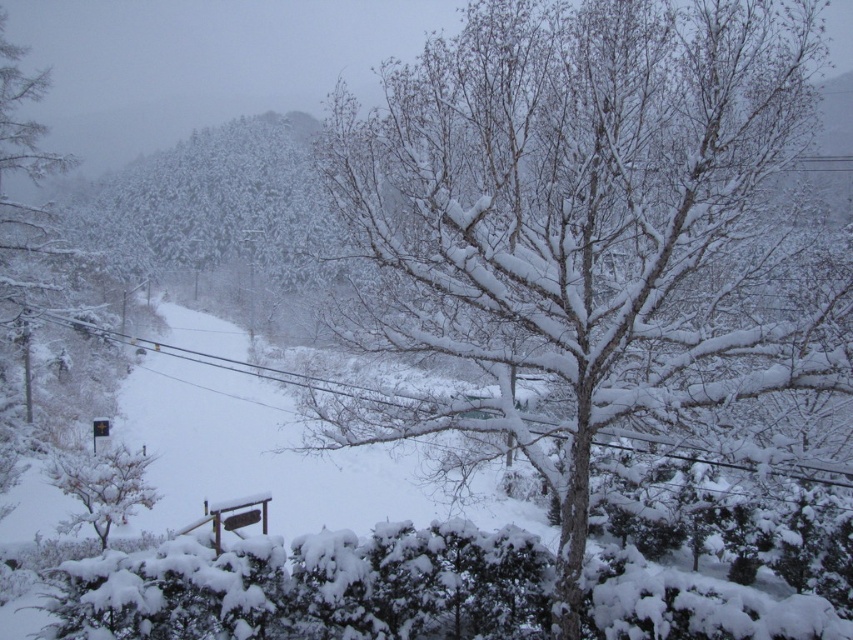
Which is above, snow-covered tree at center or white snow-covered tree at lower left?

snow-covered tree at center is higher up.

Is point (578, 387) closer to camera compared to point (114, 512)?

That is True.

I want to click on snow-covered tree at center, so click(589, 227).